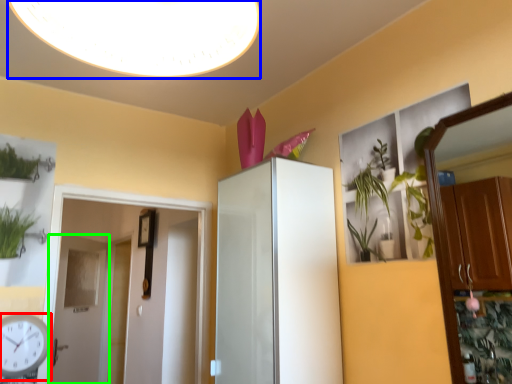
Question: Which object is positioned closest to clock (highlighted by a red box)? Select from light fixture (highlighted by a blue box) and door (highlighted by a green box).

Choices:
 (A) light fixture
 (B) door

Answer: (A)